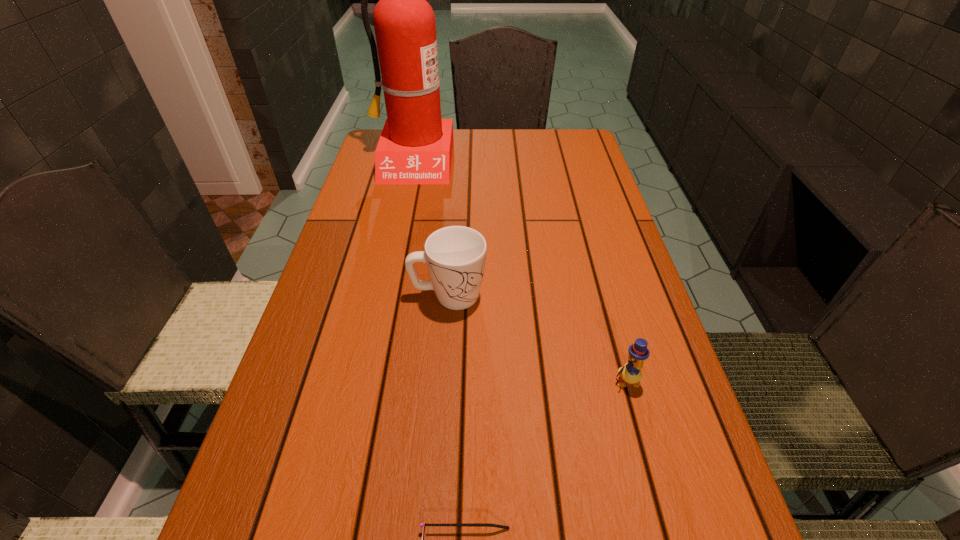
The height and width of the screenshot is (540, 960). In order to click on object situated at the left edge in this screenshot , I will do `click(415, 147)`.

Find the location of a particular element. The width and height of the screenshot is (960, 540). object at the right edge is located at coordinates (631, 373).

You are a GUI agent. You are given a task and a screenshot of the screen. Output one action in this format:
    pyautogui.click(x=<x>, y=<y>)
    Task: Click on the object present at the far left corner
    This screenshot has width=960, height=540.
    Given the screenshot: What is the action you would take?
    pyautogui.click(x=415, y=147)

In the image, there is a desktop. Where is `vacant area at the far edge`? Image resolution: width=960 pixels, height=540 pixels. vacant area at the far edge is located at coordinates point(483,152).

In the image, there is a desktop. Where is `vacant space at the left edge`? This screenshot has width=960, height=540. vacant space at the left edge is located at coordinates (372, 193).

The width and height of the screenshot is (960, 540). In order to click on vacant space at the right edge of the desktop in this screenshot , I will do `click(620, 289)`.

Locate an element on the screen. The width and height of the screenshot is (960, 540). vacant space in between the second farthest object and the farthest object is located at coordinates (430, 228).

The height and width of the screenshot is (540, 960). Identify the location of free space between the rightmost object and the farthest object. (519, 271).

I want to click on vacant area that lies between the third farthest object and the tallest object, so click(519, 271).

Where is `free space between the farthest object and the rightmost object`? free space between the farthest object and the rightmost object is located at coordinates (519, 271).